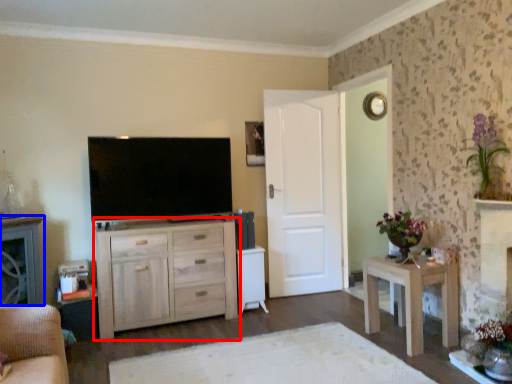
Question: Among these objects, which one is farthest to the camera, chest of drawers (highlighted by a red box) or cabinetry (highlighted by a blue box)?

Choices:
 (A) chest of drawers
 (B) cabinetry

Answer: (A)